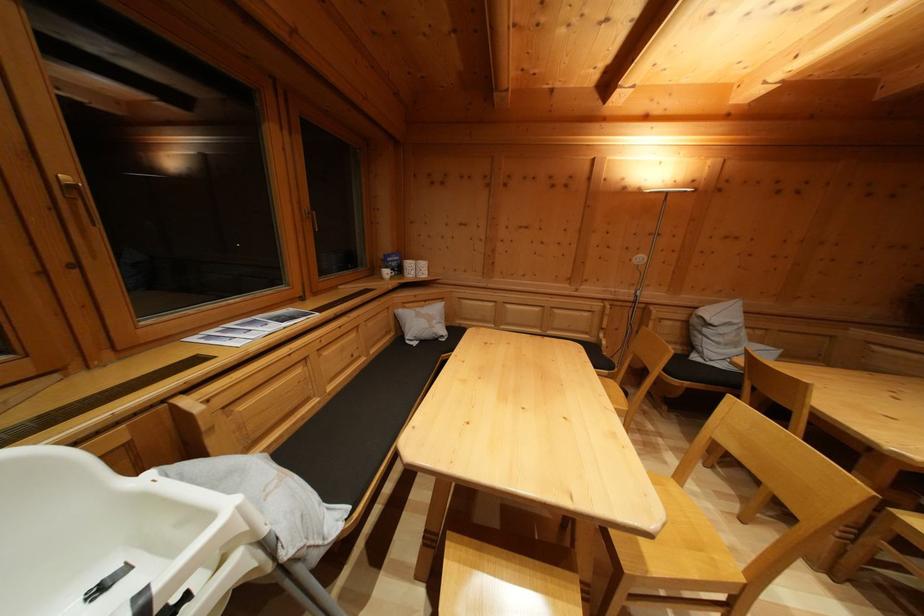
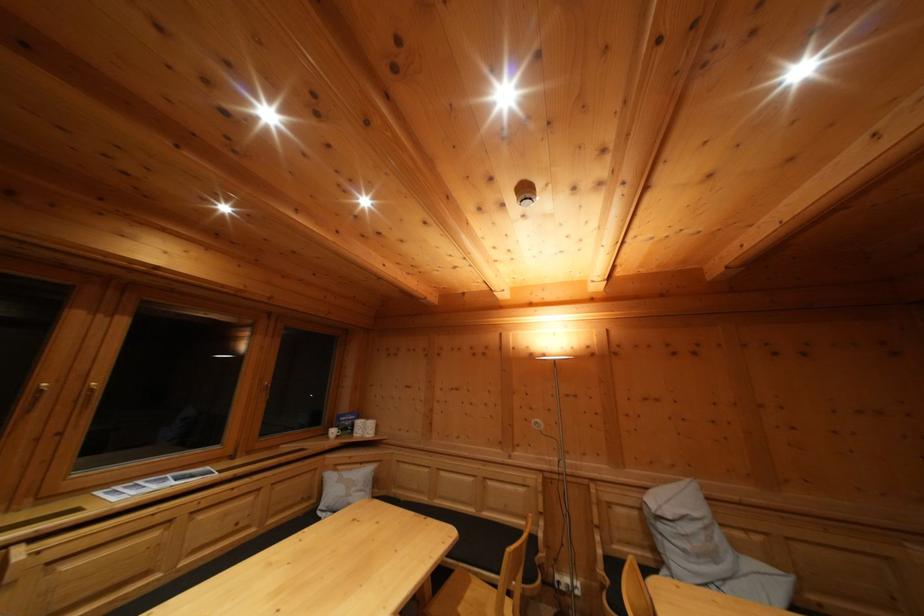
The point at [591,339] is marked in the first image. Where is the corresponding point in the second image?

(532, 525)